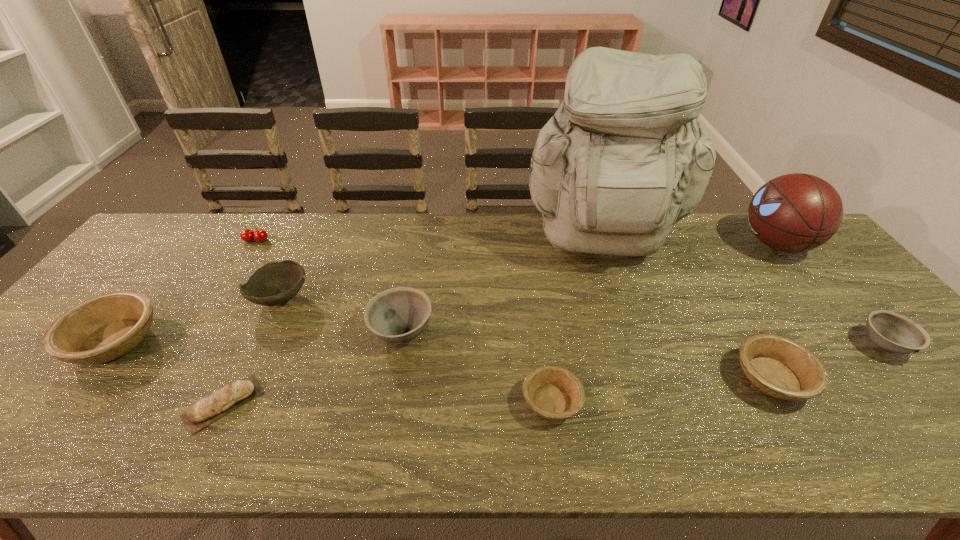
You are a GUI agent. You are given a task and a screenshot of the screen. Output one action in this format:
    pyautogui.click(x=<x>, y=<y>)
    Task: Click on the bowl that is the third closest to the tallest object
    The height and width of the screenshot is (540, 960).
    Given the screenshot: What is the action you would take?
    pos(555,393)

The width and height of the screenshot is (960, 540). Identify the location of the closest beige bowl to the fourth bowl from left to right. (778, 366).

Image resolution: width=960 pixels, height=540 pixels. In order to click on the closest beige bowl to the pita bread in this screenshot , I will do `click(103, 328)`.

What are the coordinates of `vacant space that satisfies the following two spatial constraints: 1. on the front side of the smaller gray bowl; 2. on the left side of the second tallest object` in the screenshot? It's located at (858, 345).

The width and height of the screenshot is (960, 540). In order to click on vacant point that satisfies the following two spatial constraints: 1. on the back side of the biggest beige bowl; 2. on the right side of the fifth bowl from right to left in this screenshot , I will do `click(149, 299)`.

Identify the location of vacant region that satisfies the following two spatial constraints: 1. on the back side of the basketball; 2. on the left side of the pita bread. Image resolution: width=960 pixels, height=540 pixels. (301, 244).